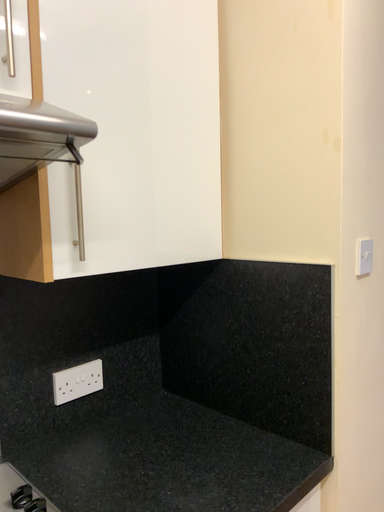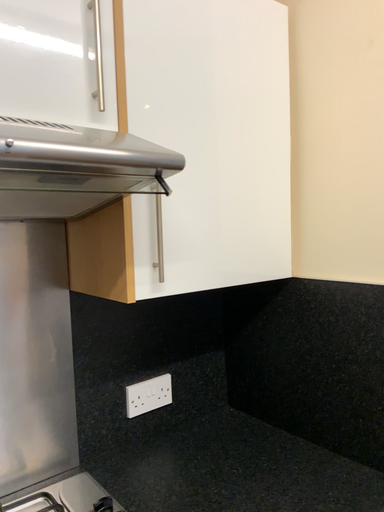
Question: How did the camera likely rotate when shooting the video?

Choices:
 (A) rotated right
 (B) rotated left

Answer: (B)